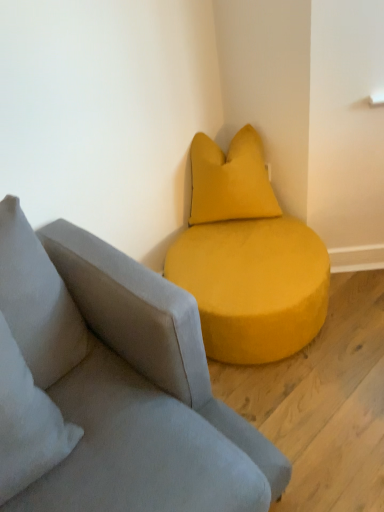
Find the location of `suede gray studio couch at center`. suede gray studio couch at center is located at coordinates (114, 386).

This screenshot has height=512, width=384. What do you see at coordinates (114, 386) in the screenshot?
I see `suede gray studio couch at center` at bounding box center [114, 386].

Find the location of a particular element. This screenshot has width=384, height=512. velvet yellow pillow at upper right is located at coordinates (230, 180).

This screenshot has height=512, width=384. Describe the element at coordinates (230, 180) in the screenshot. I see `velvet yellow pillow at upper right` at that location.

Measure the distance between point (235, 202) and camera.

5.90 feet.

Locate an element on the screen. The height and width of the screenshot is (512, 384). suede gray studio couch at center is located at coordinates (114, 386).

Considering the positions of objects suede gray studio couch at center and velvet yellow pillow at upper right in the image provided, who is more to the right, suede gray studio couch at center or velvet yellow pillow at upper right?

Positioned to the right is suede gray studio couch at center.

Is the depth of suede gray studio couch at center less than that of velvet yellow pillow at upper right?

Yes.

Considering the positions of points (185, 456) and (213, 203), is point (185, 456) closer to camera compared to point (213, 203)?

That is True.

From the image's perspective, is suede gray studio couch at center above or below velvet yellow pillow at upper right?

Clearly, from the image's perspective, suede gray studio couch at center is below velvet yellow pillow at upper right.

From a real-world perspective, is suede gray studio couch at center positioned over velvet yellow pillow at upper right based on gravity?

No, from a real-world perspective, suede gray studio couch at center is not above velvet yellow pillow at upper right.

Can you confirm if suede gray studio couch at center is thinner than velvet yellow pillow at upper right?

No, suede gray studio couch at center is not thinner than velvet yellow pillow at upper right.

Does suede gray studio couch at center have a greater height compared to velvet yellow pillow at upper right?

No.

Who is smaller, suede gray studio couch at center or velvet yellow pillow at upper right?

velvet yellow pillow at upper right is smaller.

Would you say suede gray studio couch at center contains velvet yellow pillow at upper right?

No, velvet yellow pillow at upper right is not inside suede gray studio couch at center.

Is suede gray studio couch at center next to velvet yellow pillow at upper right?

suede gray studio couch at center and velvet yellow pillow at upper right are clearly separated.

Could you tell me if suede gray studio couch at center is turned towards velvet yellow pillow at upper right?

No.

Measure the distance from suede gray studio couch at center to velvet yellow pillow at upper right.

suede gray studio couch at center and velvet yellow pillow at upper right are 33.99 inches apart from each other.

Identify the location of studio couch below the velvet yellow pillow at upper right (from a real-world perspective). The height and width of the screenshot is (512, 384). (114, 386).

Consider the image. Between velvet yellow pillow at upper right and suede gray studio couch at center, which one appears on the left side from the viewer's perspective?

velvet yellow pillow at upper right.

Which object is closer to the camera taking this photo, velvet yellow pillow at upper right or suede gray studio couch at center?

suede gray studio couch at center is closer to the camera.

Does point (209, 188) appear closer or farther from the camera than point (37, 368)?

Clearly, point (209, 188) is more distant from the camera than point (37, 368).

From the image's perspective, between velvet yellow pillow at upper right and suede gray studio couch at center, who is located below?

suede gray studio couch at center.

From a real-world perspective, is velvet yellow pillow at upper right beneath suede gray studio couch at center?

No, from a real-world perspective, velvet yellow pillow at upper right is not under suede gray studio couch at center.

Can you confirm if velvet yellow pillow at upper right is wider than suede gray studio couch at center?

Incorrect, the width of velvet yellow pillow at upper right does not surpass that of suede gray studio couch at center.

Who is taller, velvet yellow pillow at upper right or suede gray studio couch at center?

velvet yellow pillow at upper right.

Between velvet yellow pillow at upper right and suede gray studio couch at center, which one has smaller size?

With smaller size is velvet yellow pillow at upper right.

Is velvet yellow pillow at upper right positioned beyond the bounds of suede gray studio couch at center?

Result: Yes.

In the scene shown: Are velvet yellow pillow at upper right and suede gray studio couch at center making contact?

velvet yellow pillow at upper right and suede gray studio couch at center are not in contact.

Does velvet yellow pillow at upper right turn towards suede gray studio couch at center?

No, velvet yellow pillow at upper right does not turn towards suede gray studio couch at center.

The width and height of the screenshot is (384, 512). In order to click on pillow on the left side of suede gray studio couch at center in this screenshot , I will do `click(230, 180)`.

The width and height of the screenshot is (384, 512). I want to click on pillow located above the suede gray studio couch at center (from the image's perspective), so (x=230, y=180).

Where is `studio couch below the velvet yellow pillow at upper right (from a real-world perspective)`? The image size is (384, 512). studio couch below the velvet yellow pillow at upper right (from a real-world perspective) is located at coordinates (114, 386).